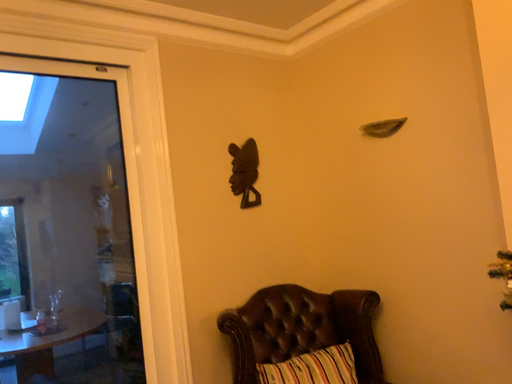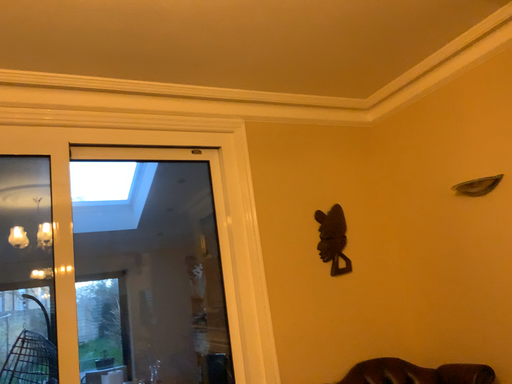
Question: Which way did the camera rotate in the video?

Choices:
 (A) rotated downward
 (B) rotated upward

Answer: (B)